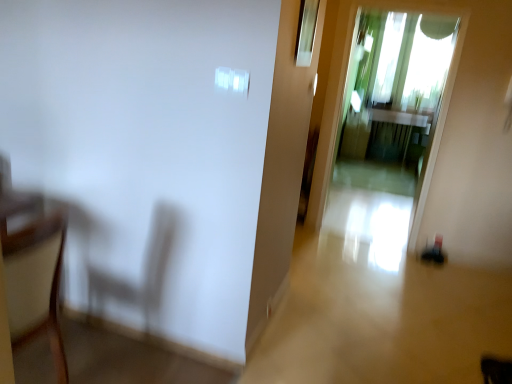
Question: Is transparent glass window at upper center wider than wooden armchair at left?

Choices:
 (A) yes
 (B) no

Answer: (B)

Question: From a real-world perspective, is transparent glass window at upper center physically below wooden armchair at left?

Choices:
 (A) no
 (B) yes

Answer: (A)

Question: Is transparent glass window at upper center placed right next to wooden armchair at left?

Choices:
 (A) yes
 (B) no

Answer: (B)

Question: Is transparent glass window at upper center completely or partially outside of wooden armchair at left?

Choices:
 (A) yes
 (B) no

Answer: (A)

Question: Can you confirm if transparent glass window at upper center is positioned to the left of wooden armchair at left?

Choices:
 (A) yes
 (B) no

Answer: (B)

Question: From a real-world perspective, is wooden armchair at left positioned above or below transparent glass screen door at center?

Choices:
 (A) below
 (B) above

Answer: (A)

Question: Considering the positions of wooden armchair at left and transparent glass screen door at center in the image, is wooden armchair at left bigger or smaller than transparent glass screen door at center?

Choices:
 (A) big
 (B) small

Answer: (B)

Question: Considering their positions, is wooden armchair at left located in front of or behind transparent glass screen door at center?

Choices:
 (A) front
 (B) behind

Answer: (A)

Question: Visually, is wooden armchair at left positioned to the left or to the right of transparent glass screen door at center?

Choices:
 (A) left
 (B) right

Answer: (A)

Question: Would you say wooden armchair at left is to the left or to the right of transparent glass window at upper center in the picture?

Choices:
 (A) left
 (B) right

Answer: (A)

Question: Is wooden armchair at left wider or thinner than transparent glass window at upper center?

Choices:
 (A) thin
 (B) wide

Answer: (B)

Question: Is point (11, 319) closer or farther from the camera than point (311, 14)?

Choices:
 (A) closer
 (B) farther

Answer: (A)

Question: Is wooden armchair at left bigger or smaller than transparent glass window at upper center?

Choices:
 (A) big
 (B) small

Answer: (A)

Question: From a real-world perspective, is transparent glass window at upper center above or below wooden armchair at left?

Choices:
 (A) above
 (B) below

Answer: (A)

Question: Is point (310, 19) positioned closer to the camera than point (56, 294)?

Choices:
 (A) closer
 (B) farther

Answer: (B)